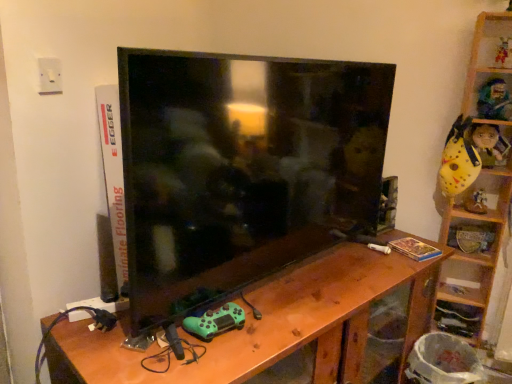
This screenshot has width=512, height=384. Identify the location of vacant space behind green matte controller at lower center, which ranks as the 1th toy in front-to-back order. tap(251, 297).